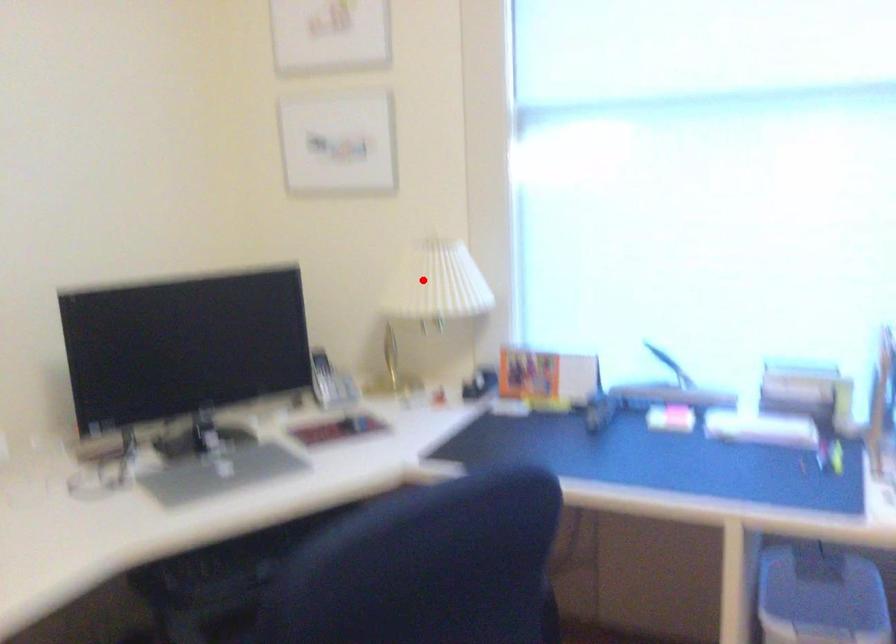
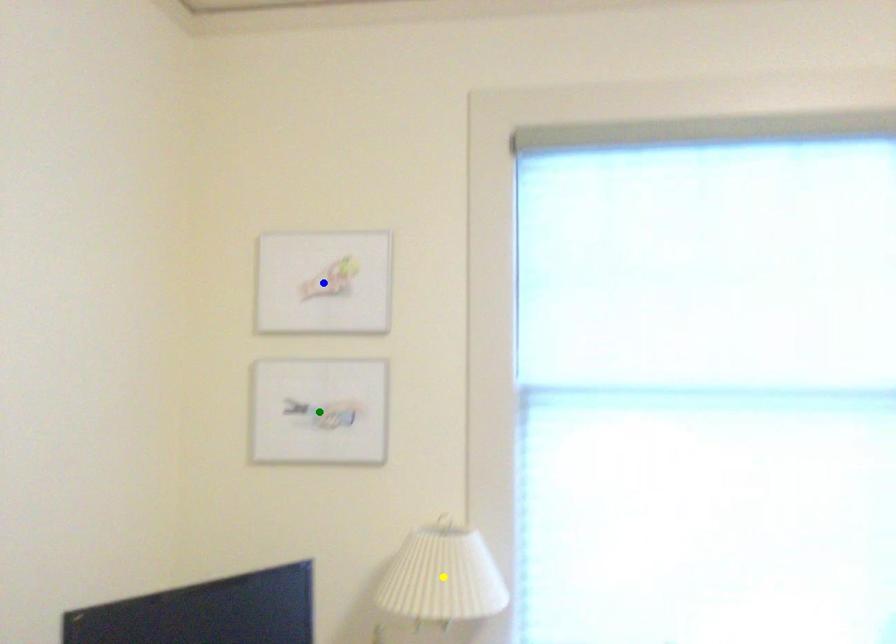
Question: I am providing you with two images of the same scene from different viewpoints. A red point is marked on the first image. You are given multiple points on the second image. Which mark in image 2 goes with the point in image 1?

Choices:
 (A) blue point
 (B) green point
 (C) yellow point

Answer: (C)